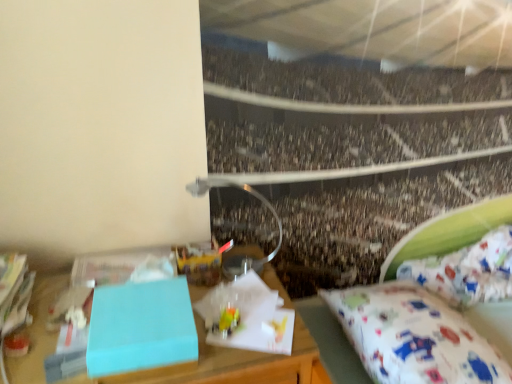
Question: Is speckled concrete crowd at center oriented towards light blue matte box at left?

Choices:
 (A) no
 (B) yes

Answer: (A)

Question: From a real-world perspective, is speckled concrete crowd at center physically above light blue matte box at left?

Choices:
 (A) yes
 (B) no

Answer: (B)

Question: Is speckled concrete crowd at center surrounding light blue matte box at left?

Choices:
 (A) yes
 (B) no

Answer: (B)

Question: Is the depth of speckled concrete crowd at center less than that of light blue matte box at left?

Choices:
 (A) yes
 (B) no

Answer: (B)

Question: Can you confirm if speckled concrete crowd at center is bigger than light blue matte box at left?

Choices:
 (A) yes
 (B) no

Answer: (A)

Question: In terms of height, does light blue matte box at left look taller or shorter compared to white fabric mattress at lower right?

Choices:
 (A) tall
 (B) short

Answer: (B)

Question: From the image's perspective, is light blue matte box at left positioned above or below white fabric mattress at lower right?

Choices:
 (A) above
 (B) below

Answer: (A)

Question: Do you think light blue matte box at left is within white fabric mattress at lower right, or outside of it?

Choices:
 (A) outside
 (B) inside

Answer: (A)

Question: From a real-world perspective, is light blue matte box at left physically located above or below white fabric mattress at lower right?

Choices:
 (A) above
 (B) below

Answer: (A)

Question: From the image's perspective, is light blue matte box at left positioned above or below metallic silver lamp at upper center?

Choices:
 (A) above
 (B) below

Answer: (B)

Question: Is light blue matte box at left to the left or to the right of metallic silver lamp at upper center in the image?

Choices:
 (A) right
 (B) left

Answer: (B)

Question: Is point (162, 345) closer or farther from the camera than point (234, 274)?

Choices:
 (A) closer
 (B) farther

Answer: (A)

Question: Is light blue matte box at left taller or shorter than metallic silver lamp at upper center?

Choices:
 (A) tall
 (B) short

Answer: (B)

Question: Which is correct: speckled concrete crowd at center is inside metallic silver lamp at upper center, or outside of it?

Choices:
 (A) inside
 (B) outside

Answer: (B)

Question: From their relative heights in the image, would you say speckled concrete crowd at center is taller or shorter than metallic silver lamp at upper center?

Choices:
 (A) tall
 (B) short

Answer: (A)